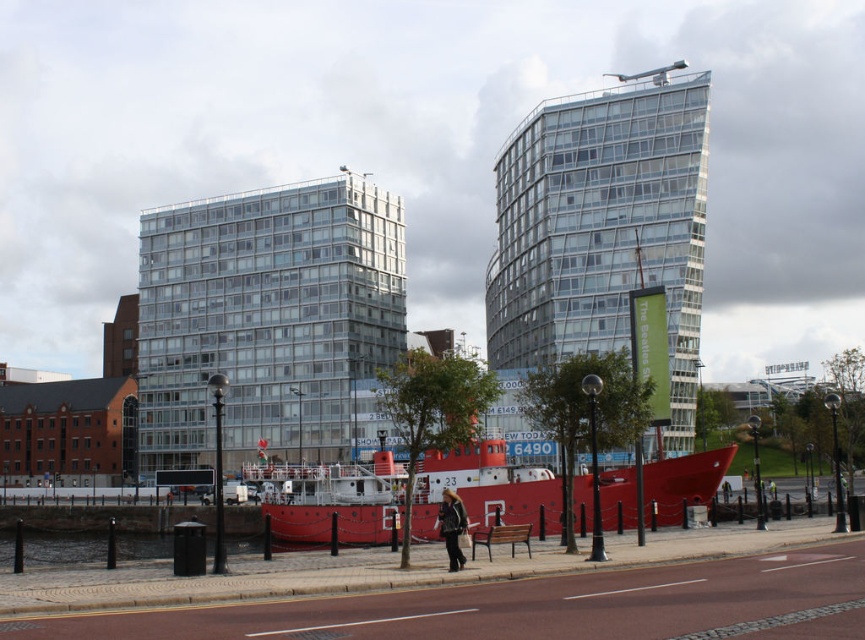
Question: Is transparent glass building at upper center bigger than metallic red boat at center?

Choices:
 (A) no
 (B) yes

Answer: (B)

Question: Can you confirm if transparent glass building at upper center is bigger than metallic red boat at center?

Choices:
 (A) no
 (B) yes

Answer: (B)

Question: Which object is the closest to the transparent glass building at upper center?

Choices:
 (A) metallic red boat at center
 (B) glassy reflective building at center

Answer: (B)

Question: Does glassy reflective building at center have a larger size compared to metallic red boat at center?

Choices:
 (A) no
 (B) yes

Answer: (B)

Question: Which of the following is the farthest from the observer?

Choices:
 (A) transparent glass building at upper center
 (B) metallic red boat at center

Answer: (A)

Question: Which object appears closest to the camera in this image?

Choices:
 (A) transparent glass building at upper center
 (B) glassy reflective building at center
 (C) metallic red boat at center

Answer: (C)